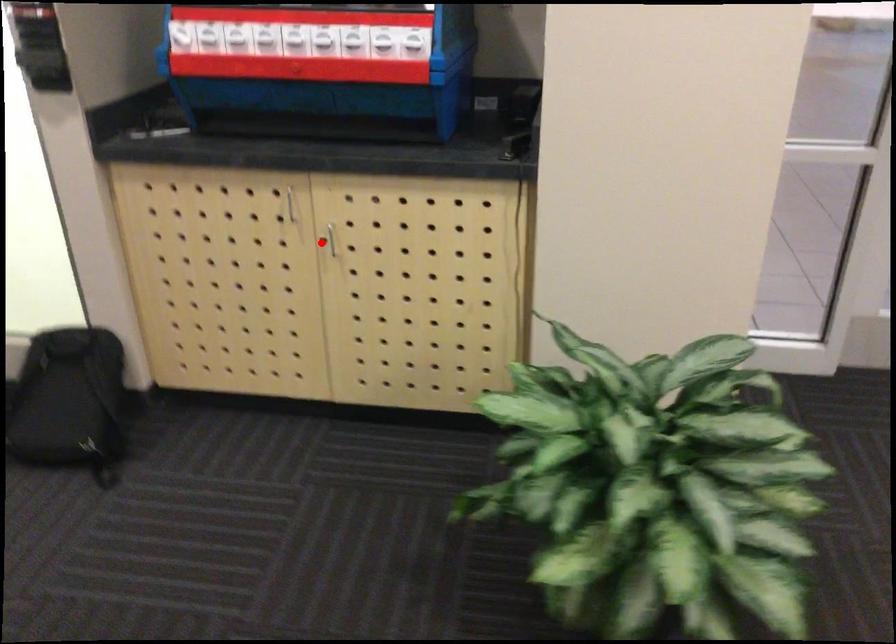
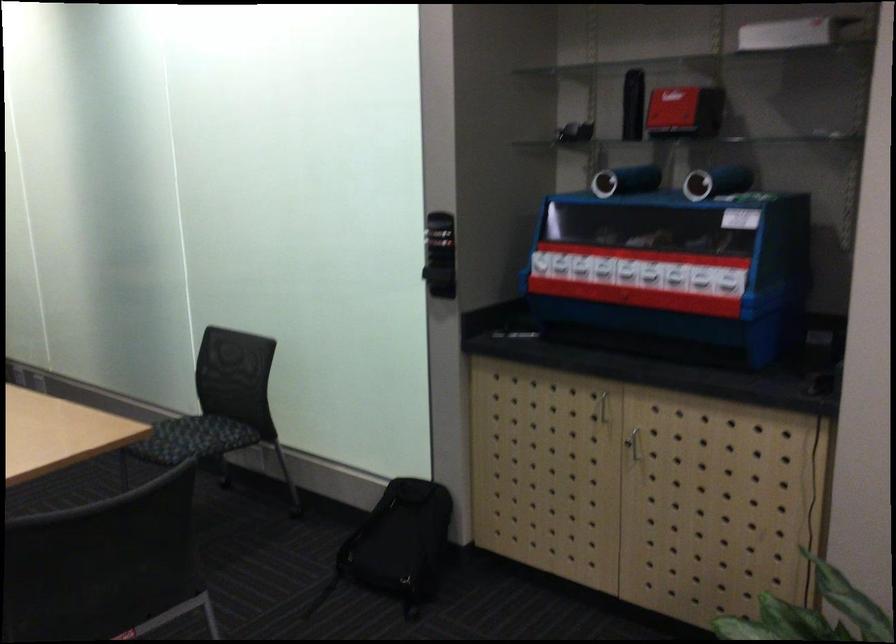
Find the pixel in the second image that matches the highlighted location in the first image.

(633, 442)